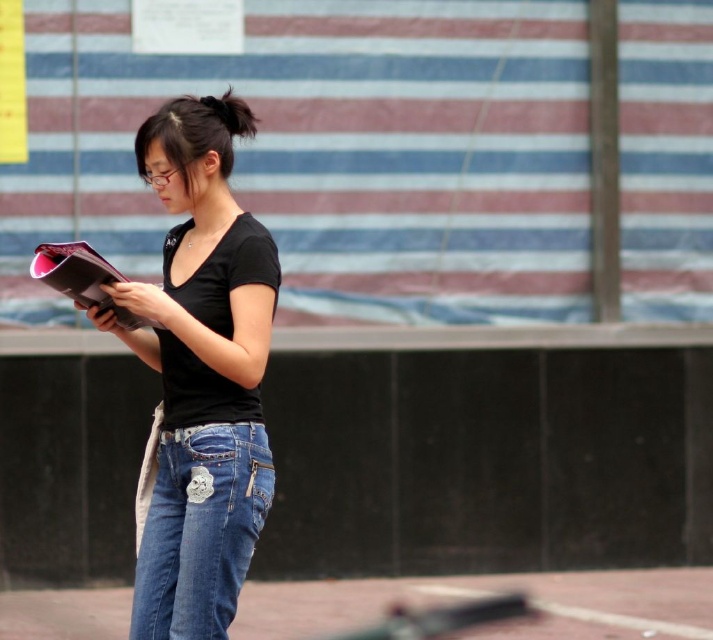
Question: Does black matte shirt at center appear under denim jeans at lower center?

Choices:
 (A) yes
 (B) no

Answer: (B)

Question: Which object is farther from the camera taking this photo?

Choices:
 (A) black matte shirt at center
 (B) denim jeans at lower center

Answer: (A)

Question: Which point appears farthest from the camera in this image?

Choices:
 (A) (195, 198)
 (B) (150, 627)

Answer: (A)

Question: Does black matte shirt at center have a smaller size compared to denim jeans at lower center?

Choices:
 (A) yes
 (B) no

Answer: (B)

Question: Considering the relative positions of black matte shirt at center and denim jeans at lower center in the image provided, where is black matte shirt at center located with respect to denim jeans at lower center?

Choices:
 (A) below
 (B) above

Answer: (B)